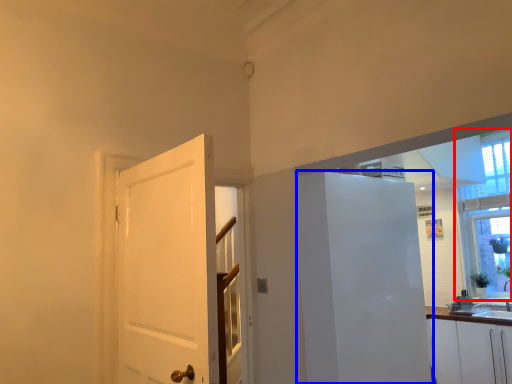
Question: Among these objects, which one is nearest to the camera, window (highlighted by a red box) or elevator (highlighted by a blue box)?

Choices:
 (A) window
 (B) elevator

Answer: (B)